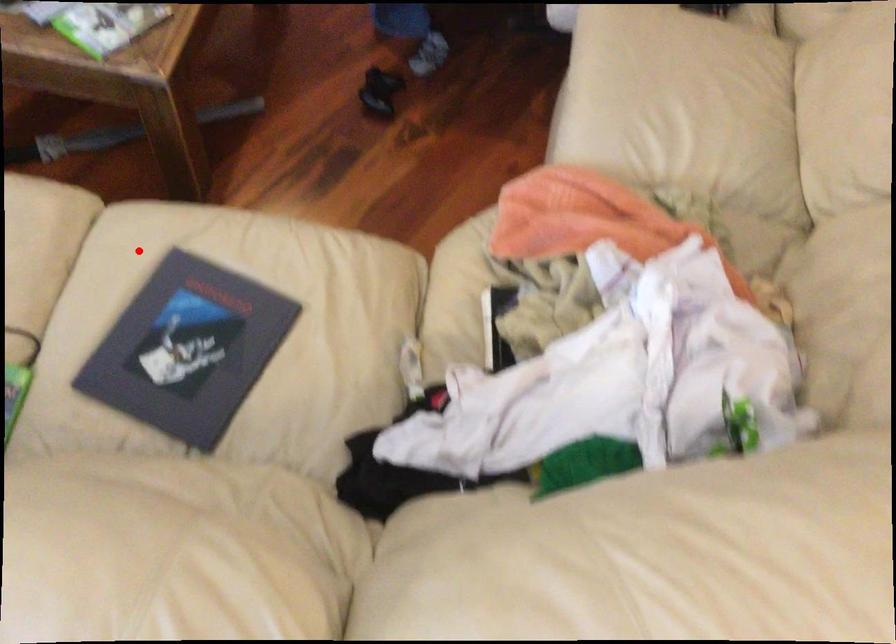
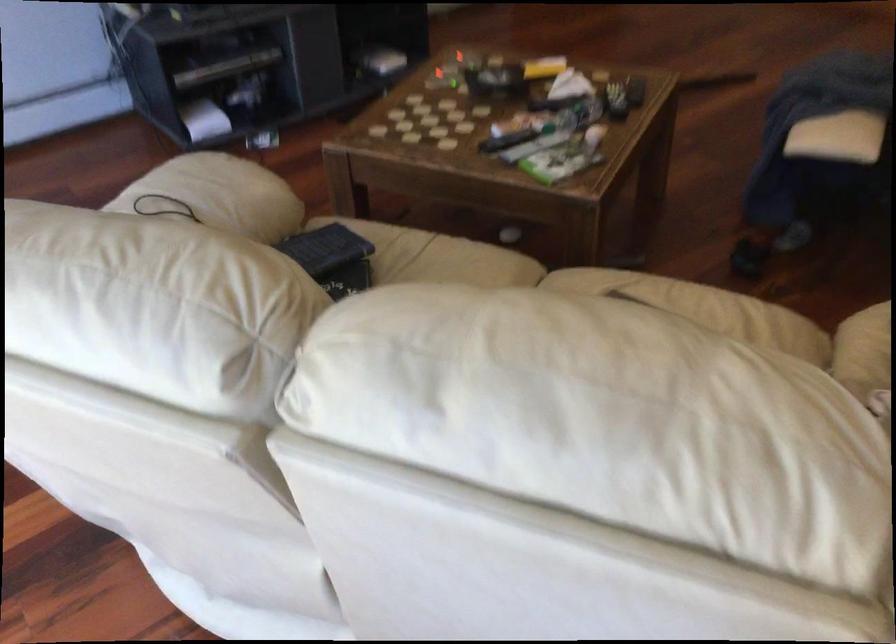
Locate, in the second image, the point that corresponds to the highlighted location in the first image.

(584, 285)